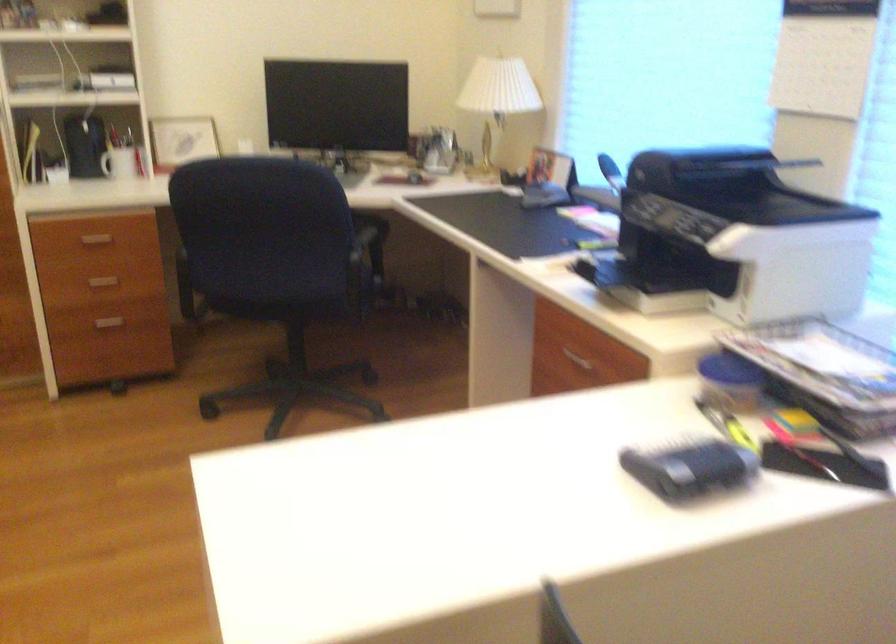
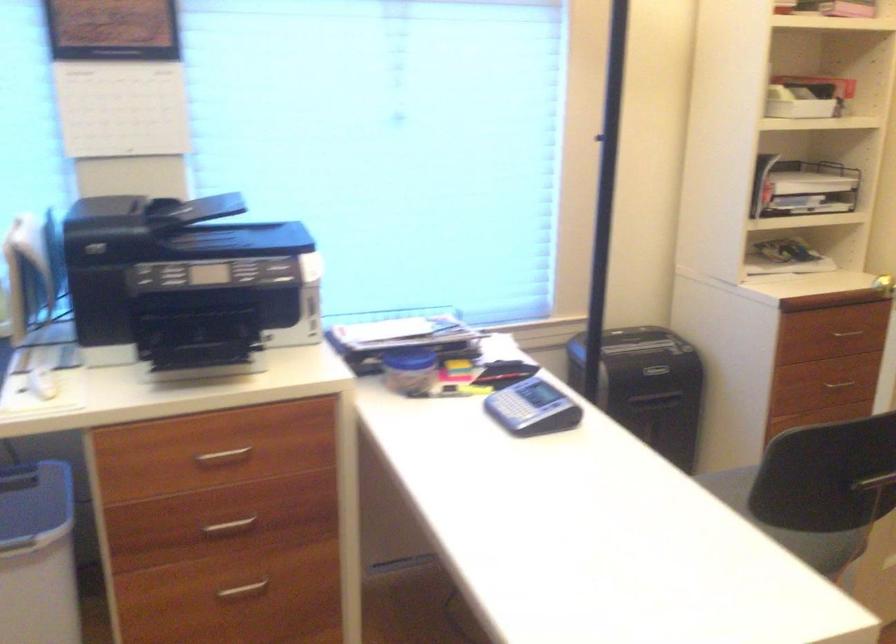
Where in the second image is the point corresponding to point (745, 167) from the first image?

(199, 209)